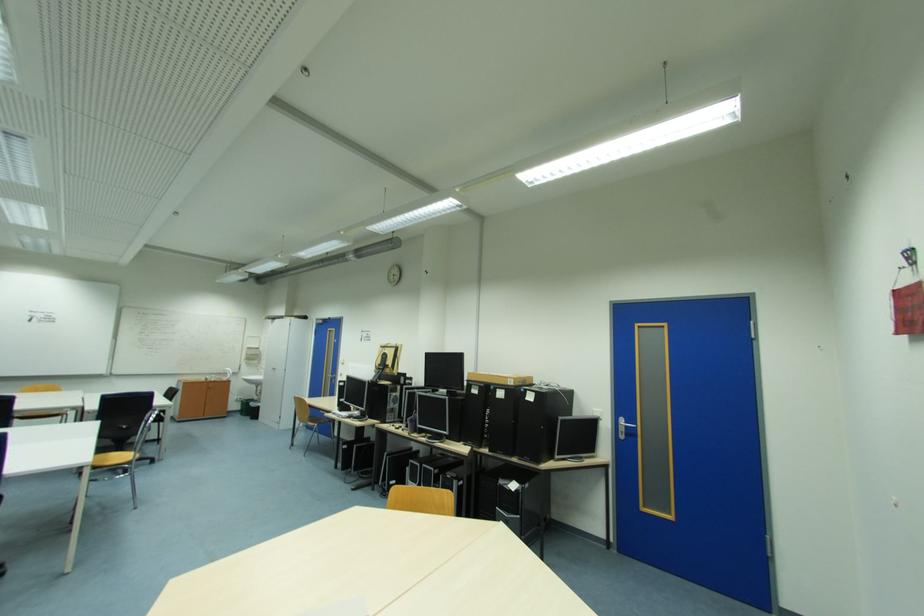
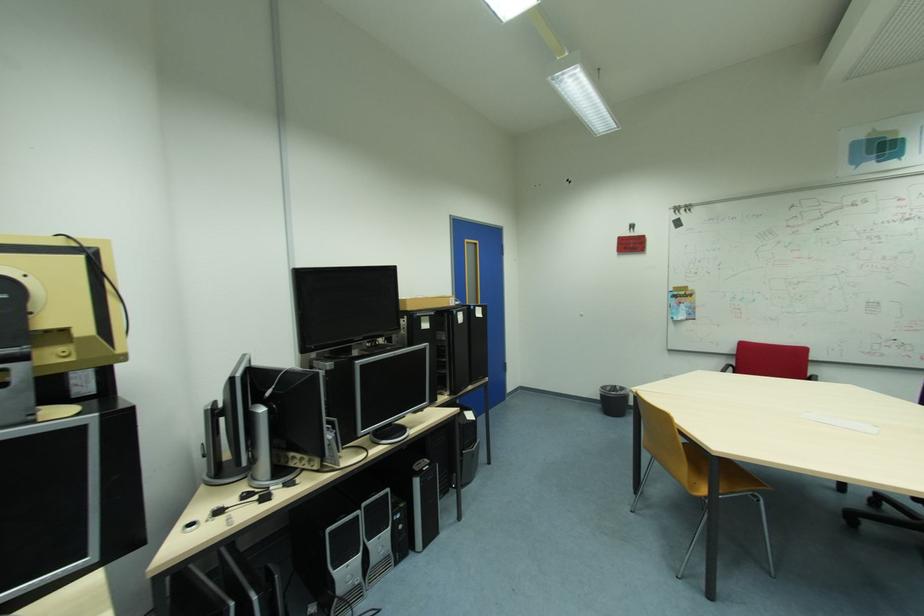
Find the pixel in the second image that matches point (481, 392) in the first image.

(432, 326)